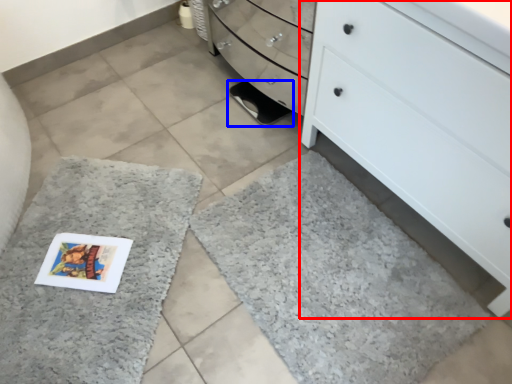
Question: Which point is closer to the camera, chest of drawers (highlighted by a red box) or footwear (highlighted by a blue box)?

Choices:
 (A) chest of drawers
 (B) footwear

Answer: (A)